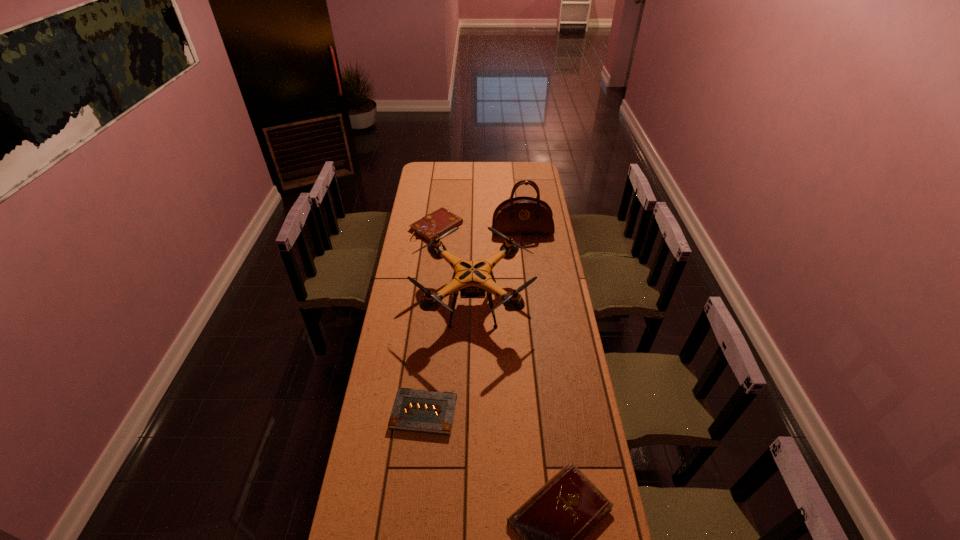
Where is `vacant area that lies between the drone and the tallest object`? The height and width of the screenshot is (540, 960). vacant area that lies between the drone and the tallest object is located at coordinates (498, 267).

Choose which object is the nearest neighbor to the third nearest object. Please provide its 2D coordinates. Your answer should be formatted as a tuple, i.e. [(x, y)], where the tuple contains the x and y coordinates of a point satisfying the conditions above.

[(437, 223)]

Identify the location of object that is the fourth closest to the second farthest notebook. Image resolution: width=960 pixels, height=540 pixels. (521, 215).

In order to click on the second closest notebook to the drone in this screenshot , I will do `click(423, 411)`.

Where is `notebook identified as the second closest to the tallest object`? notebook identified as the second closest to the tallest object is located at coordinates (423, 411).